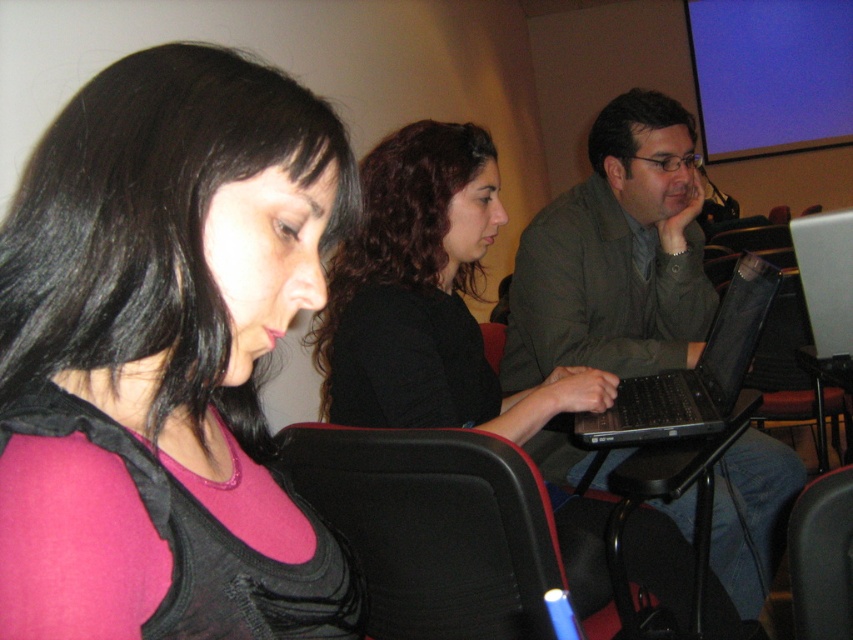
Question: Which point is farther to the camera?

Choices:
 (A) (74, 470)
 (B) (766, 296)
 (C) (337, 426)
 (D) (824, 616)

Answer: (B)

Question: Among these objects, which one is nearest to the camera?

Choices:
 (A) black leather chair at lower center
 (B) black plastic laptop at right

Answer: (A)

Question: Which of the following is the closest to the observer?

Choices:
 (A) (485, 561)
 (B) (672, 433)
 (C) (790, 520)

Answer: (C)

Question: Can you confirm if pink matte/black fabric at center is bigger than black leather chair at lower center?

Choices:
 (A) no
 (B) yes

Answer: (A)

Question: Can you confirm if matte gray jacket at center is wider than black leather chair at lower center?

Choices:
 (A) no
 (B) yes

Answer: (B)

Question: Does pink matte/black fabric at center come in front of black plastic laptop at right?

Choices:
 (A) no
 (B) yes

Answer: (B)